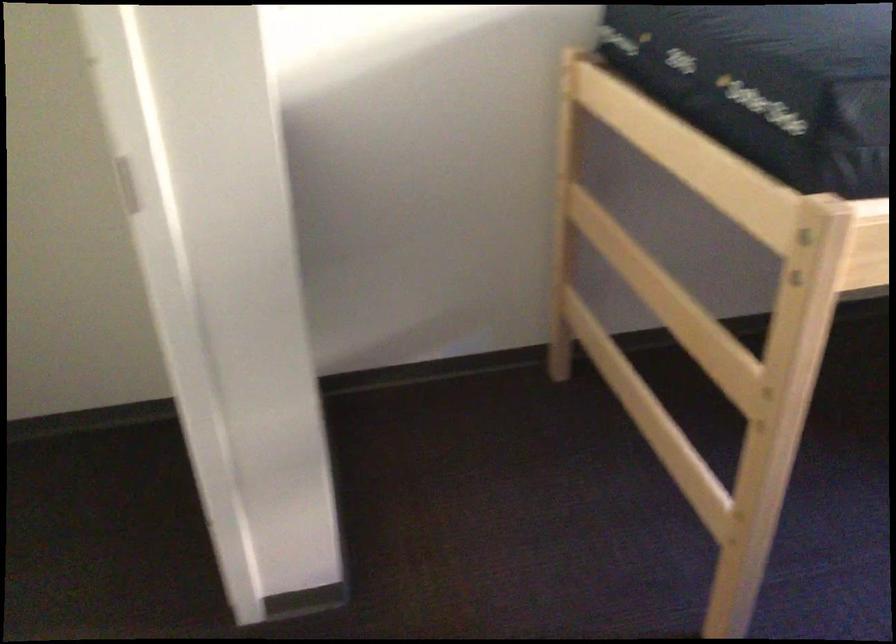
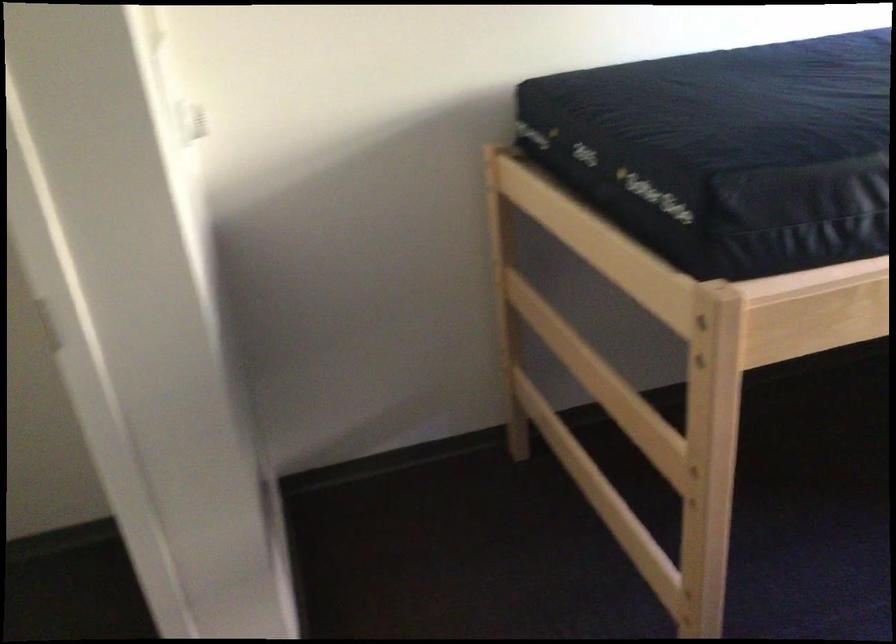
The point at [573,310] is marked in the first image. Where is the corresponding point in the second image?

(524, 392)